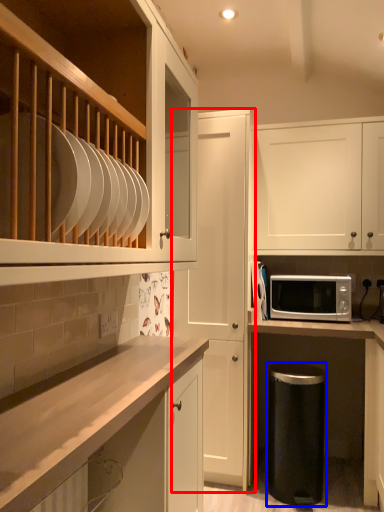
Question: Which object is closer to the camera taking this photo, cabinetry (highlighted by a red box) or dish washer (highlighted by a blue box)?

Choices:
 (A) cabinetry
 (B) dish washer

Answer: (B)